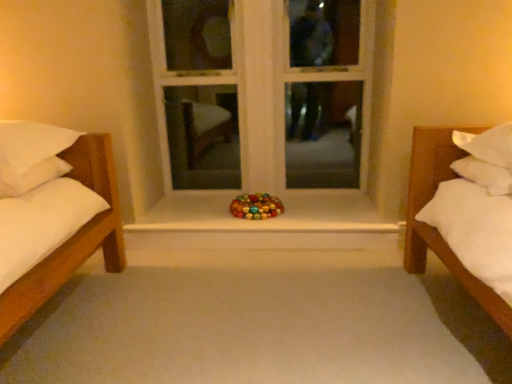
Question: Should I look upward or downward to see white wood window frame at center?

Choices:
 (A) down
 (B) up

Answer: (B)

Question: Is glossy plastic toy at center positioned before smooth white surface at center?

Choices:
 (A) no
 (B) yes

Answer: (A)

Question: From the image's perspective, is glossy plastic toy at center located above smooth white surface at center?

Choices:
 (A) no
 (B) yes

Answer: (B)

Question: From a real-world perspective, is glossy plastic toy at center located higher than smooth white surface at center?

Choices:
 (A) no
 (B) yes

Answer: (B)

Question: Can you confirm if glossy plastic toy at center is positioned to the left of smooth white surface at center?

Choices:
 (A) no
 (B) yes

Answer: (B)

Question: Is glossy plastic toy at center behind smooth white surface at center?

Choices:
 (A) yes
 (B) no

Answer: (A)

Question: Does glossy plastic toy at center have a greater width compared to smooth white surface at center?

Choices:
 (A) no
 (B) yes

Answer: (A)

Question: Considering the relative sizes of white wood window frame at center and smooth white surface at center in the image provided, is white wood window frame at center thinner than smooth white surface at center?

Choices:
 (A) yes
 (B) no

Answer: (A)

Question: Is white wood window frame at center positioned with its back to smooth white surface at center?

Choices:
 (A) yes
 (B) no

Answer: (B)

Question: From a real-world perspective, is white wood window frame at center located higher than smooth white surface at center?

Choices:
 (A) yes
 (B) no

Answer: (A)

Question: Can you confirm if white wood window frame at center is wider than smooth white surface at center?

Choices:
 (A) no
 (B) yes

Answer: (A)

Question: Is white wood window frame at center bigger than smooth white surface at center?

Choices:
 (A) no
 (B) yes

Answer: (B)

Question: Is white wood window frame at center positioned behind smooth white surface at center?

Choices:
 (A) no
 (B) yes

Answer: (B)

Question: From the image's perspective, would you say glossy plastic toy at center is positioned over white wood window frame at center?

Choices:
 (A) yes
 (B) no

Answer: (B)